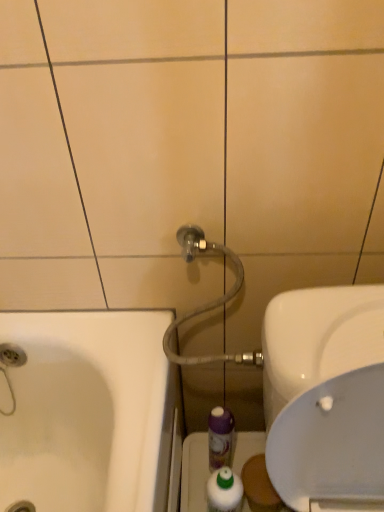
Question: Is white glossy sink at right far from matte gray hose at upper center?

Choices:
 (A) no
 (B) yes

Answer: (A)

Question: Is white glossy sink at right thinner than matte gray hose at upper center?

Choices:
 (A) yes
 (B) no

Answer: (B)

Question: From a real-world perspective, is white glossy sink at right over matte gray hose at upper center?

Choices:
 (A) yes
 (B) no

Answer: (B)

Question: Considering the relative sizes of white glossy sink at right and matte gray hose at upper center in the image provided, is white glossy sink at right taller than matte gray hose at upper center?

Choices:
 (A) yes
 (B) no

Answer: (A)

Question: Considering the relative sizes of white glossy sink at right and matte gray hose at upper center in the image provided, is white glossy sink at right shorter than matte gray hose at upper center?

Choices:
 (A) no
 (B) yes

Answer: (A)

Question: Is white glossy sink at right wider than matte gray hose at upper center?

Choices:
 (A) no
 (B) yes

Answer: (B)

Question: Can transparent plastic bottle at lower center be found inside white glossy mouthwash at lower center, the 1th mouthwash viewed from the front?

Choices:
 (A) yes
 (B) no

Answer: (B)

Question: From the image's perspective, is white glossy mouthwash at lower center, the 2th mouthwash positioned from the back, under transparent plastic bottle at lower center?

Choices:
 (A) no
 (B) yes

Answer: (A)

Question: Does white glossy mouthwash at lower center, the 1th mouthwash viewed from the front, touch transparent plastic bottle at lower center?

Choices:
 (A) no
 (B) yes

Answer: (A)

Question: From the image's perspective, is white glossy mouthwash at lower center, the 2th mouthwash positioned from the back, on top of transparent plastic bottle at lower center?

Choices:
 (A) no
 (B) yes

Answer: (B)

Question: Considering the relative positions of white glossy mouthwash at lower center, the 1th mouthwash viewed from the front, and transparent plastic bottle at lower center in the image provided, is white glossy mouthwash at lower center, the 1th mouthwash viewed from the front, in front of transparent plastic bottle at lower center?

Choices:
 (A) no
 (B) yes

Answer: (B)

Question: Can you confirm if white glossy mouthwash at lower center, the 2th mouthwash positioned from the back, is shorter than transparent plastic bottle at lower center?

Choices:
 (A) no
 (B) yes

Answer: (B)

Question: From the image's perspective, is white glossy mouthwash at lower center, the 2th mouthwash positioned from the back, over matte gray hose at upper center?

Choices:
 (A) no
 (B) yes

Answer: (A)